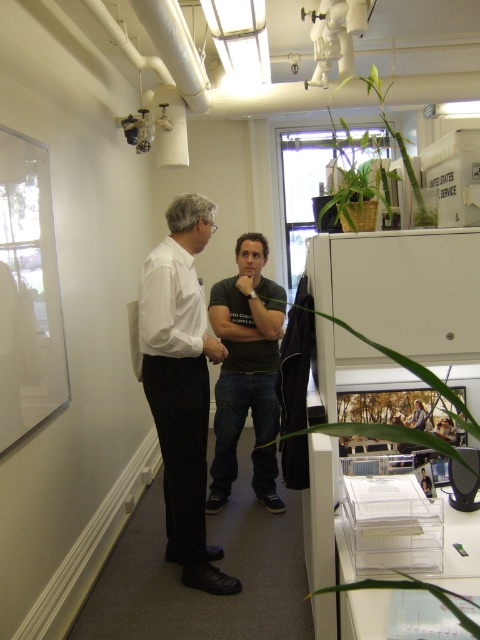
Question: Which of the following is the farthest from the observer?

Choices:
 (A) green leafy plant at lower right
 (B) white smooth shirt at center
 (C) green leafy plant at right

Answer: (B)

Question: Among these points, which one is nearest to the camera?

Choices:
 (A) (382, 97)
 (B) (411, 579)
 (C) (256, 396)

Answer: (B)

Question: Does green leafy plant at lower right have a smaller size compared to green leafy plant at upper center?

Choices:
 (A) no
 (B) yes

Answer: (B)

Question: Among these objects, which one is farthest from the camera?

Choices:
 (A) dark green t-shirt at center
 (B) green leafy plant at right

Answer: (A)

Question: Is white smooth shirt at center wider than green leafy plant at upper center?

Choices:
 (A) no
 (B) yes

Answer: (A)

Question: Does dark green t-shirt at center appear on the right side of green leafy plant at lower right?

Choices:
 (A) no
 (B) yes

Answer: (A)